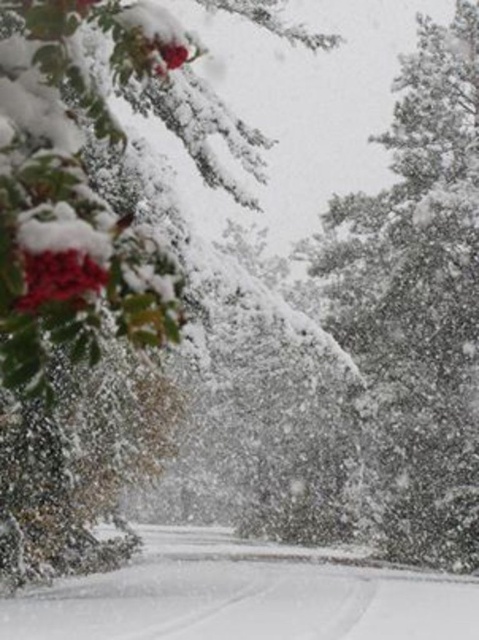
Which is below, white fluffy snow at upper right or white fluffy snow at center?

white fluffy snow at center is lower down.

Can you confirm if white fluffy snow at upper right is smaller than white fluffy snow at center?

No.

The height and width of the screenshot is (640, 479). What do you see at coordinates (418, 300) in the screenshot? I see `white fluffy snow at upper right` at bounding box center [418, 300].

Locate an element on the screen. Image resolution: width=479 pixels, height=640 pixels. white fluffy snow at upper right is located at coordinates (418, 300).